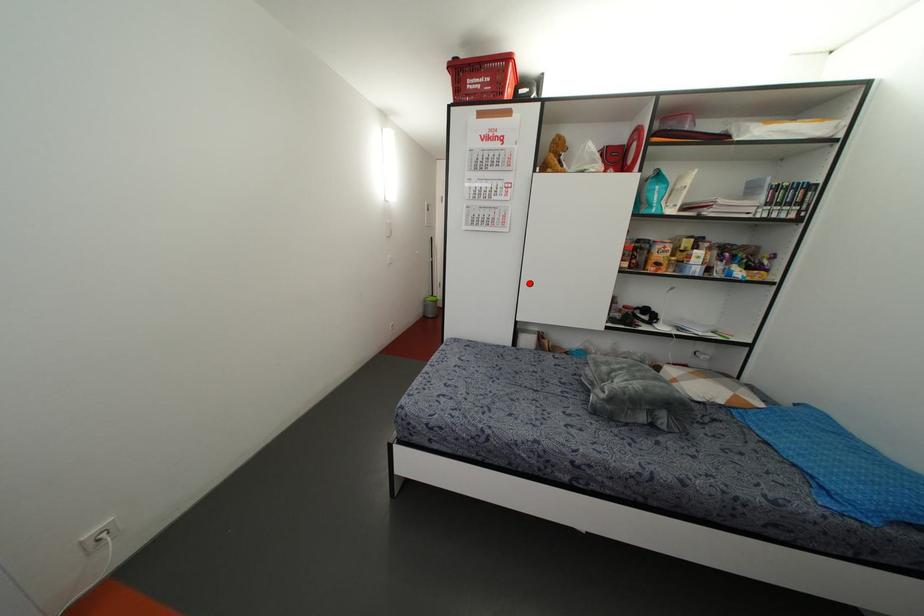
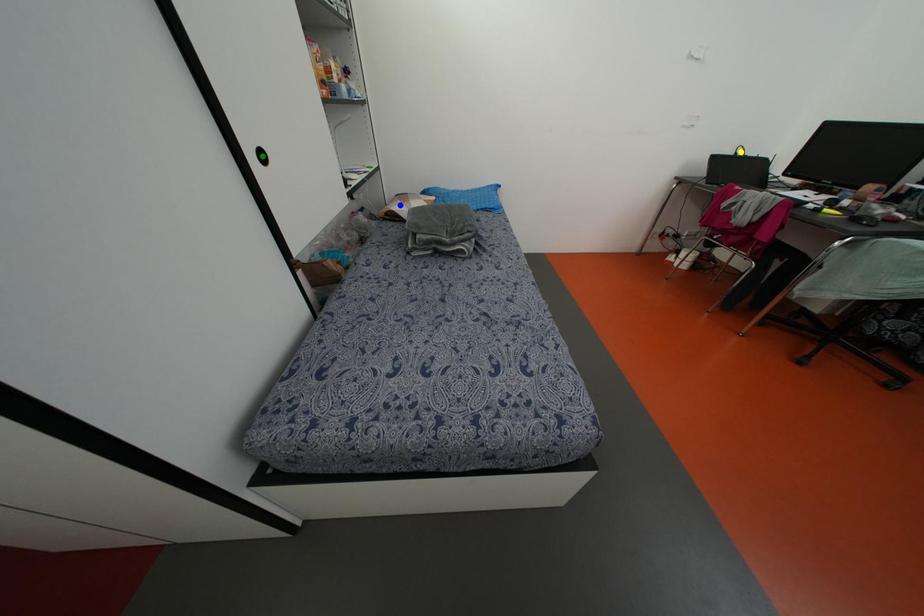
Question: I am providing you with two images of the same scene from different viewpoints. A red point is marked on the first image. You are given multiple points on the second image. Which point in image 2 represents the same 3d spot as the red point in image 1?

Choices:
 (A) yellow point
 (B) blue point
 (C) green point

Answer: (C)